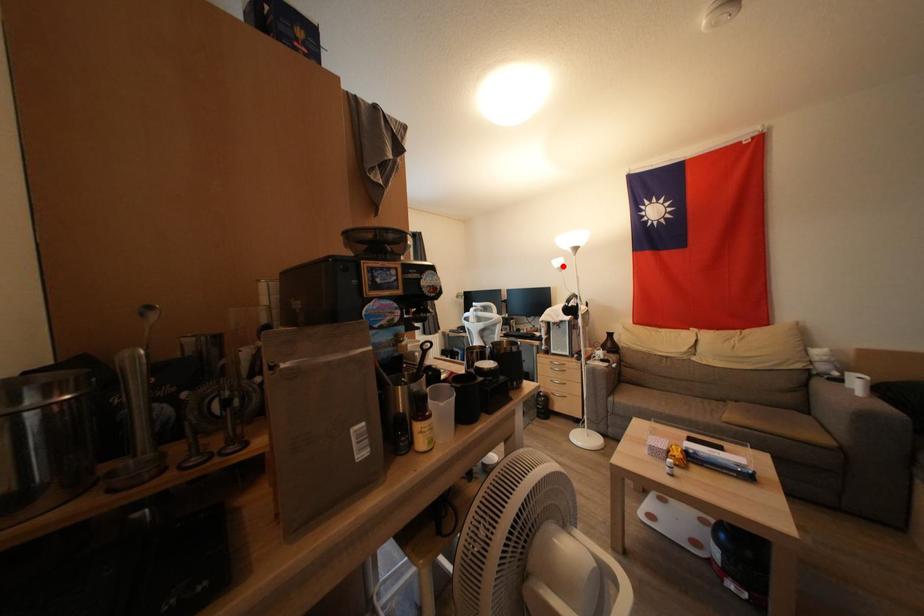
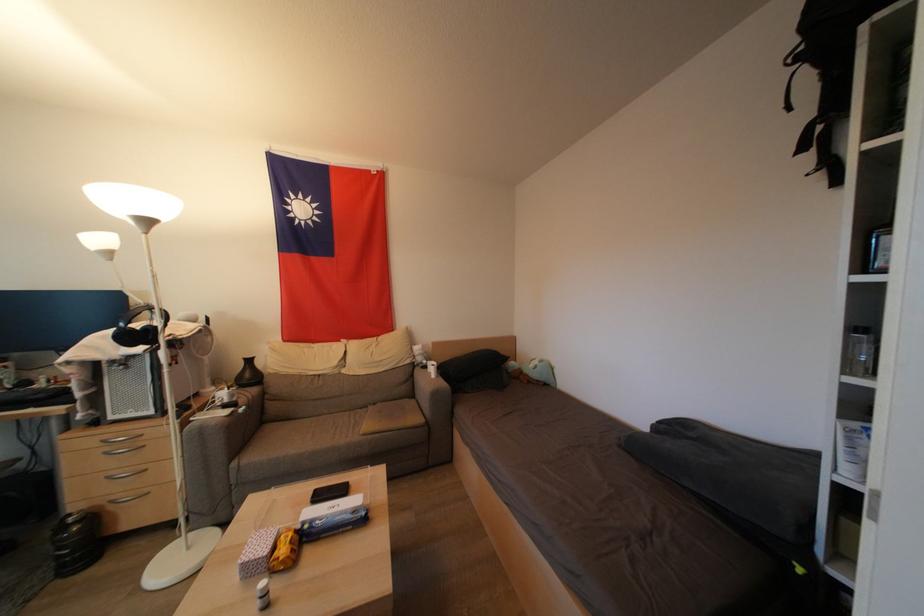
Question: I am providing you with two images of the same scene from different viewpoints. Given a red point in image1, look at the same physical point in image2. Is it:

Choices:
 (A) Closer to the viewpoint
 (B) Farther from the viewpoint

Answer: (B)